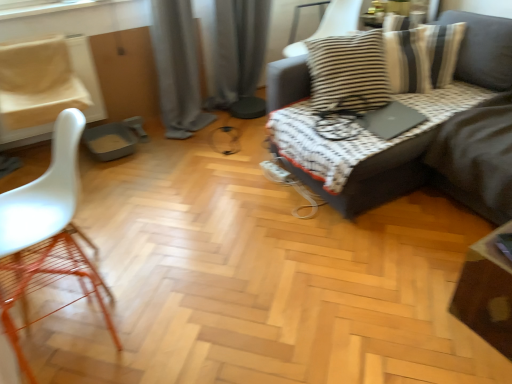
The height and width of the screenshot is (384, 512). Find the location of `vacant space behind white matte chair at left, the 2th chair from the left`. vacant space behind white matte chair at left, the 2th chair from the left is located at coordinates [127, 222].